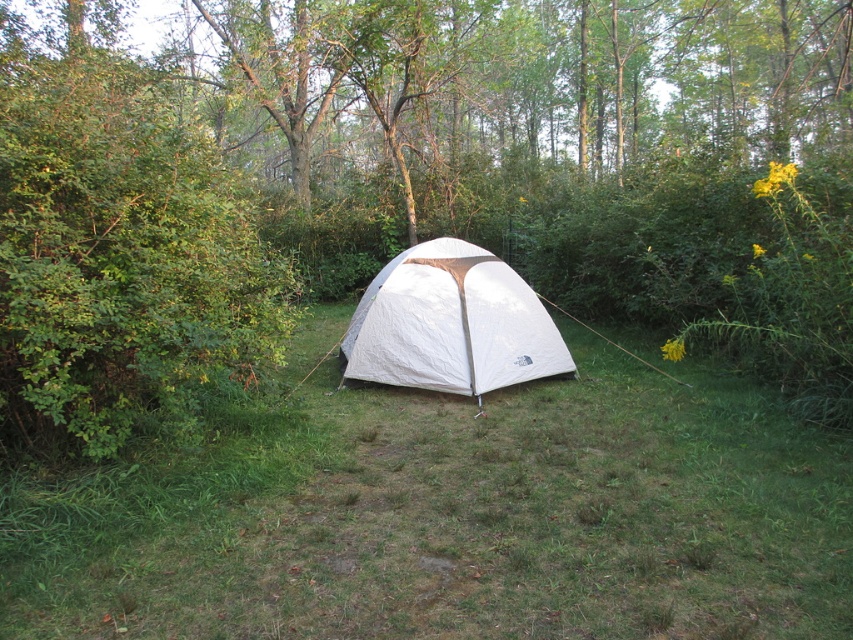
Question: Which object is farther from the camera taking this photo?

Choices:
 (A) green grassy at center
 (B) white fabric tent at center

Answer: (B)

Question: Can you confirm if green grassy at center is positioned below white fabric tent at center?

Choices:
 (A) no
 (B) yes

Answer: (B)

Question: Among these points, which one is nearest to the camera?

Choices:
 (A) (3, 541)
 (B) (519, 296)

Answer: (A)

Question: Can you confirm if green grassy at center is wider than white fabric tent at center?

Choices:
 (A) no
 (B) yes

Answer: (B)

Question: Is green grassy at center further to the viewer compared to white fabric tent at center?

Choices:
 (A) yes
 (B) no

Answer: (B)